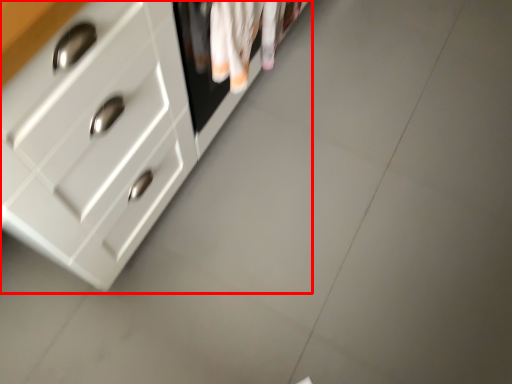
Question: Where is chest of drawers (annotated by the red box) located in relation to laundry in the image?

Choices:
 (A) right
 (B) left

Answer: (B)